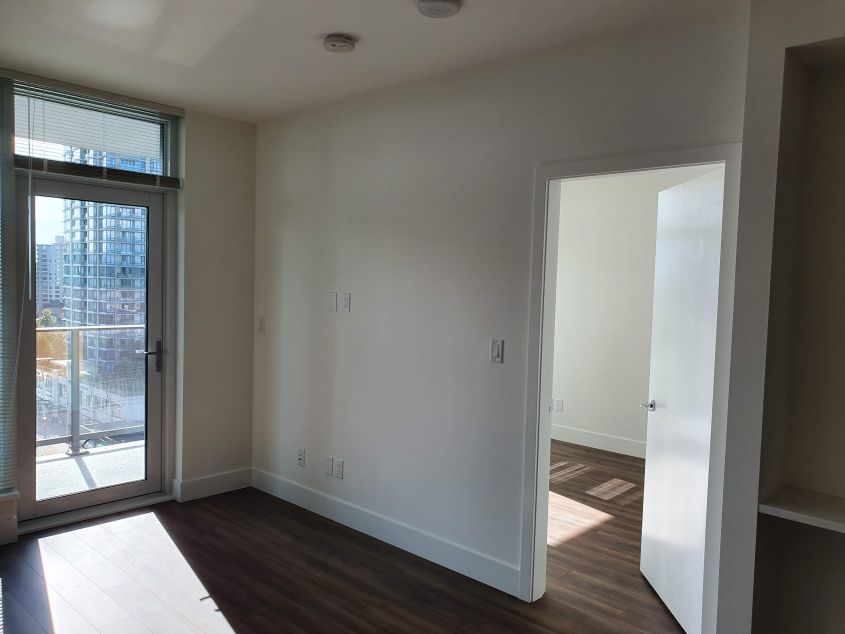
Identify the location of doorways. Image resolution: width=845 pixels, height=634 pixels. (597, 375), (94, 344).